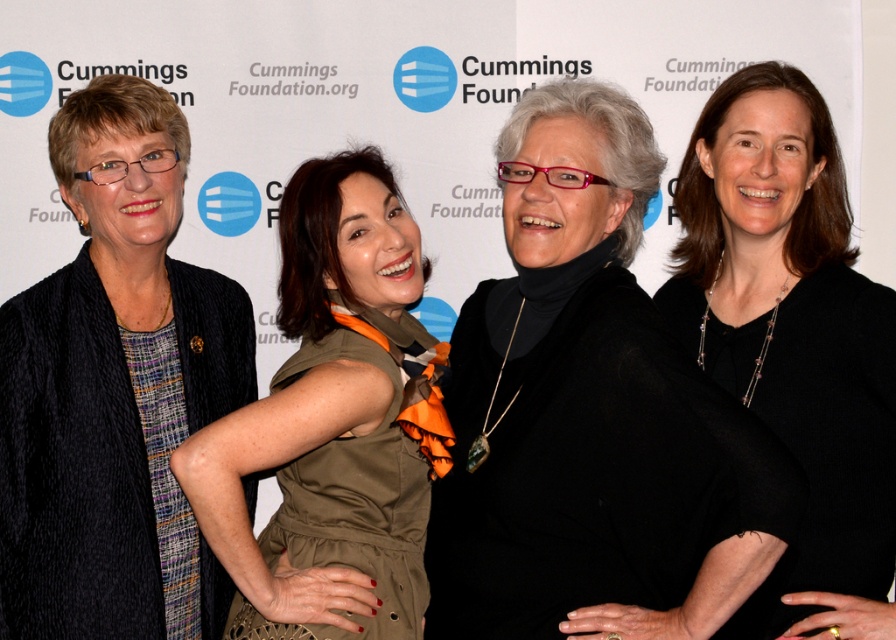
Describe the element at coordinates (589, 412) in the screenshot. I see `black matte sweater at center` at that location.

Who is positioned more to the left, black matte sweater at center or black matte dress at right?

black matte sweater at center

Between point (679, 545) and point (829, 369), which one is positioned behind?

Point (829, 369)

Where is `black matte sweater at center`? The image size is (896, 640). black matte sweater at center is located at coordinates (589, 412).

Identify the location of black matte sweater at center. The height and width of the screenshot is (640, 896). (589, 412).

From the picture: Does black matte sweater at center appear on the right side of matte black cardigan at left?

Indeed, black matte sweater at center is positioned on the right side of matte black cardigan at left.

Does point (565, 512) lie behind point (11, 621)?

No.

Where is `black matte sweater at center`? The image size is (896, 640). black matte sweater at center is located at coordinates (589, 412).

Who is lower down, matte olive green dress at center or black matte dress at right?

Positioned lower is matte olive green dress at center.

Who is more distant from viewer, [312,332] or [842,324]?

Positioned behind is point [312,332].

Does point (281, 317) come farther from viewer compared to point (688, 189)?

No, (281, 317) is closer to viewer.

Identify the location of matte olive green dress at center. (333, 422).